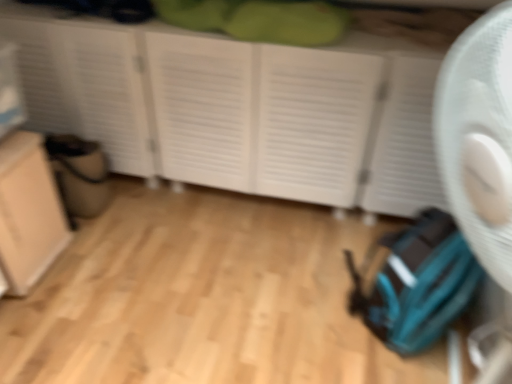
Question: Does beige matte cabinet at lower left have a smaller size compared to white matte cupboard at center?

Choices:
 (A) no
 (B) yes

Answer: (B)

Question: Is beige matte cabinet at lower left at the left side of white matte cupboard at center?

Choices:
 (A) no
 (B) yes

Answer: (B)

Question: From a real-world perspective, is beige matte cabinet at lower left below white matte cupboard at center?

Choices:
 (A) yes
 (B) no

Answer: (A)

Question: Could white matte cupboard at center be considered to be inside beige matte cabinet at lower left?

Choices:
 (A) no
 (B) yes

Answer: (A)

Question: Does beige matte cabinet at lower left turn towards white matte cupboard at center?

Choices:
 (A) no
 (B) yes

Answer: (A)

Question: From the image's perspective, is beige matte cabinet at lower left above white matte cupboard at center?

Choices:
 (A) no
 (B) yes

Answer: (A)

Question: Can you confirm if white matte cupboard at center is positioned to the right of beige matte cabinet at lower left?

Choices:
 (A) yes
 (B) no

Answer: (A)

Question: Is white matte cupboard at center at the left side of beige matte cabinet at lower left?

Choices:
 (A) no
 (B) yes

Answer: (A)

Question: Is white matte cupboard at center positioned far away from beige matte cabinet at lower left?

Choices:
 (A) no
 (B) yes

Answer: (A)

Question: From the image's perspective, does white matte cupboard at center appear lower than beige matte cabinet at lower left?

Choices:
 (A) yes
 (B) no

Answer: (B)

Question: From a real-world perspective, is white matte cupboard at center physically below beige matte cabinet at lower left?

Choices:
 (A) no
 (B) yes

Answer: (A)

Question: Does white matte cupboard at center contain beige matte cabinet at lower left?

Choices:
 (A) no
 (B) yes

Answer: (A)

Question: From the image's perspective, relative to white matte cupboard at center, is beige matte cabinet at lower left above or below?

Choices:
 (A) above
 (B) below

Answer: (B)